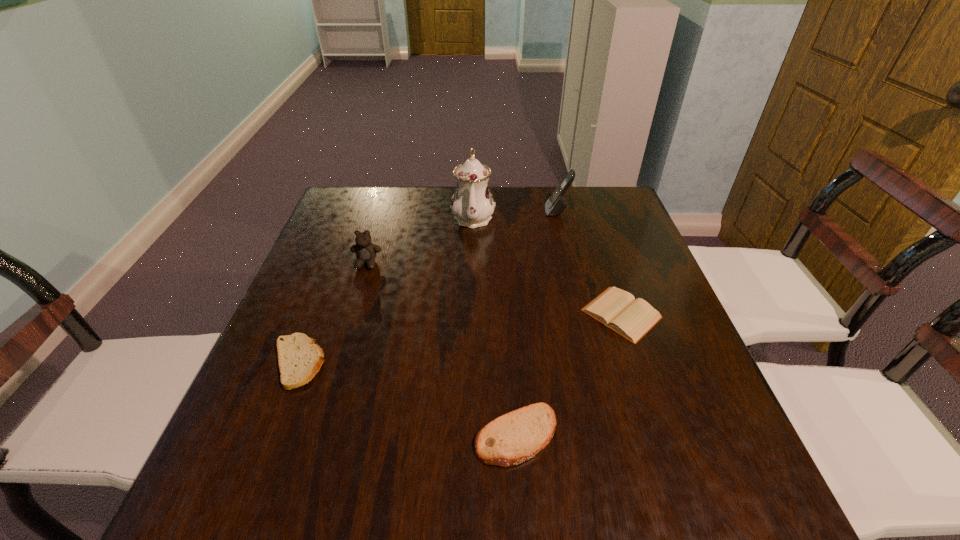
You are a GUI agent. You are given a task and a screenshot of the screen. Output one action in this format:
    pyautogui.click(x=<x>, y=<y>)
    Task: Click on the free space located on the front-facing side of the second tallest object
    The image size is (960, 540).
    Given the screenshot: What is the action you would take?
    pyautogui.click(x=421, y=212)

Where is `free location located 0.070m on the front-facing side of the second tallest object`? The height and width of the screenshot is (540, 960). free location located 0.070m on the front-facing side of the second tallest object is located at coordinates (522, 212).

This screenshot has height=540, width=960. In order to click on vacant space situated on the front-facing side of the second tallest object in this screenshot , I will do `click(470, 212)`.

Where is `vacant point located on the face of the third tallest object`? The width and height of the screenshot is (960, 540). vacant point located on the face of the third tallest object is located at coordinates click(340, 353).

I want to click on vacant position located 0.300m on the left of the right pita bread, so click(x=308, y=435).

Identify the location of vacant region located on the back of the farther pita bread. (322, 302).

The image size is (960, 540). In order to click on free region located on the back of the diary in this screenshot , I will do `click(598, 244)`.

Image resolution: width=960 pixels, height=540 pixels. Find the location of `chinaware located at the far edge`. chinaware located at the far edge is located at coordinates (472, 205).

Find the location of a particular element. cellular telephone located in the far edge section of the desktop is located at coordinates (555, 205).

Image resolution: width=960 pixels, height=540 pixels. In order to click on teddy bear situated at the left edge in this screenshot , I will do `click(366, 252)`.